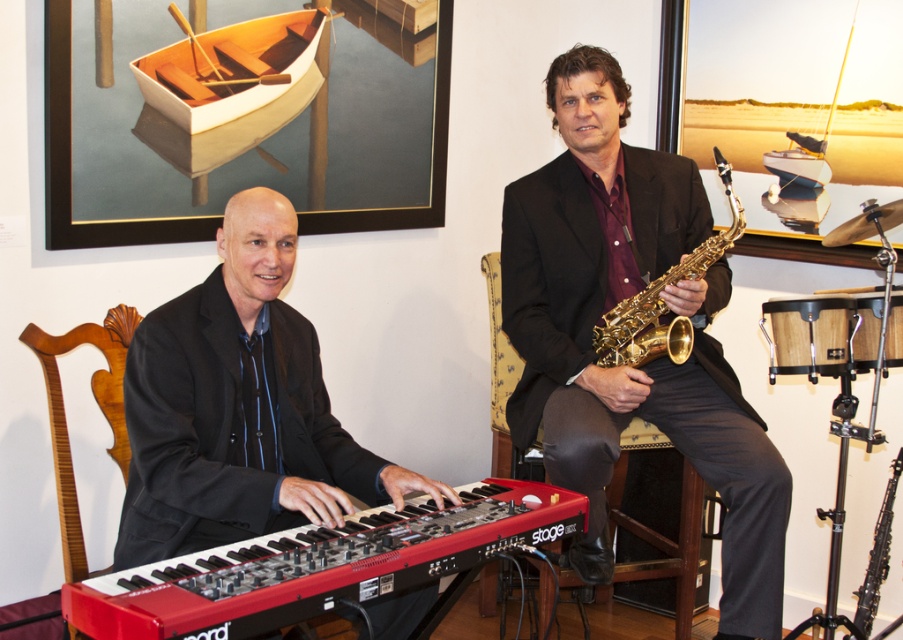
This screenshot has width=903, height=640. What do you see at coordinates (601, 323) in the screenshot?
I see `shiny gold saxophone at center` at bounding box center [601, 323].

Does point (594, 170) lie behind point (328, 580)?

Yes.

Between point (538, 202) and point (347, 568), which one is positioned in front?

Point (347, 568) is more forward.

I want to click on shiny gold saxophone at center, so click(601, 323).

Can you confirm if yellow fabric chair at center is positioned to the left of white wooden boat at upper right?

Correct, you'll find yellow fabric chair at center to the left of white wooden boat at upper right.

Identify the location of yellow fabric chair at center. (658, 531).

This screenshot has width=903, height=640. Find the location of `yellow fabric chair at center`. yellow fabric chair at center is located at coordinates (658, 531).

Is point (146, 442) positioned in front of point (858, 614)?

Yes, point (146, 442) is closer to viewer.

Can you confirm if black matte keyboard at left is positioned to the left of black glossy oboe at right?

Correct, you'll find black matte keyboard at left to the left of black glossy oboe at right.

Image resolution: width=903 pixels, height=640 pixels. What do you see at coordinates (239, 406) in the screenshot?
I see `black matte keyboard at left` at bounding box center [239, 406].

I want to click on black matte keyboard at left, so click(239, 406).